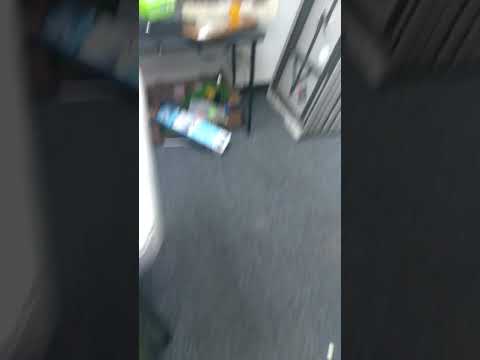
This screenshot has width=480, height=360. I want to click on carpet, so click(x=208, y=294), click(x=274, y=235), click(x=187, y=186), click(x=284, y=287).